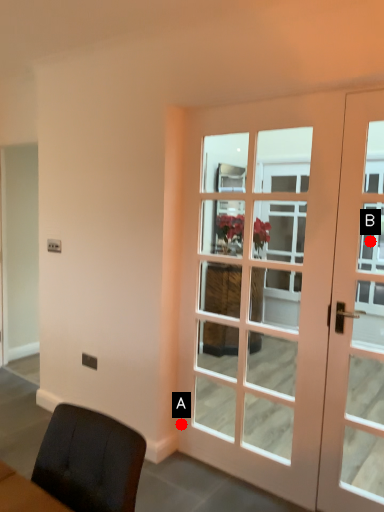
Question: Two points are circled on the image, labeled by A and B beside each circle. Which of the following is the farthest from the observer?

Choices:
 (A) A is further
 (B) B is further

Answer: (A)